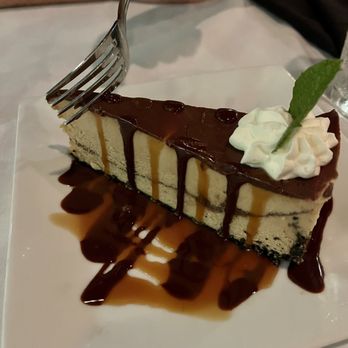
Locate an element on the screen. The image size is (348, 348). plate is located at coordinates coord(33,203), coord(264,87).